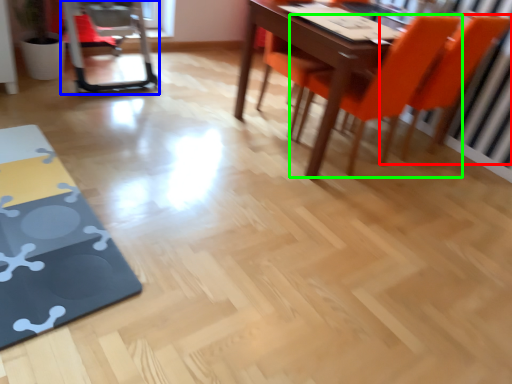
Question: Which object is positioned farthest from chair (highlighted by a red box)? Select from swivel chair (highlighted by a blue box) and chair (highlighted by a green box).

Choices:
 (A) swivel chair
 (B) chair

Answer: (A)